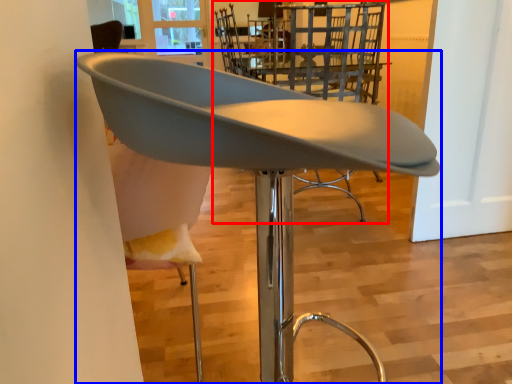
Question: Which object appears closest to the camera in this image, chair (highlighted by a red box) or chair (highlighted by a blue box)?

Choices:
 (A) chair
 (B) chair

Answer: (B)